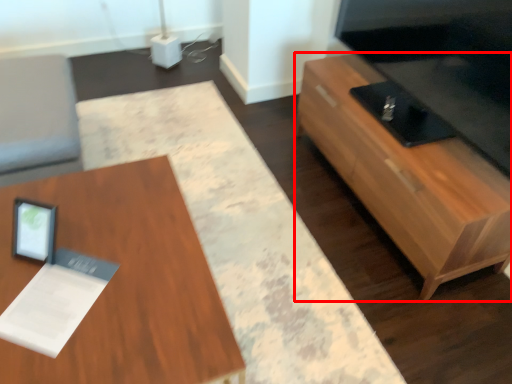
Question: In this image, where is table (annotated by the red box) located relative to table?

Choices:
 (A) right
 (B) left

Answer: (A)